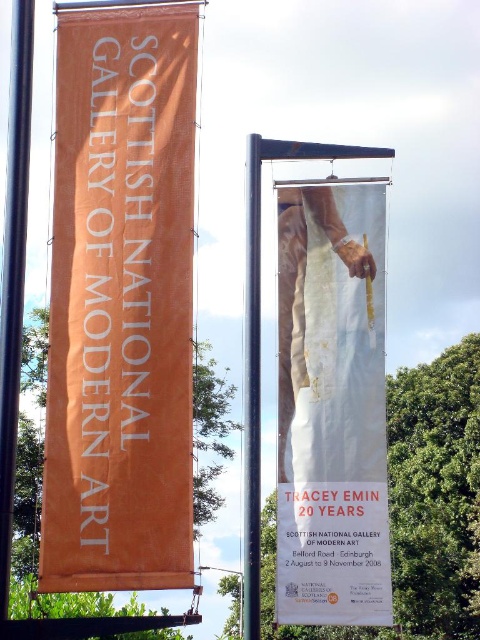
Question: Which point appears closest to the camera in this image?

Choices:
 (A) (139, 490)
 (B) (348, 220)

Answer: (A)

Question: Is orange fabric banner at left to the left of white paper at center from the viewer's perspective?

Choices:
 (A) yes
 (B) no

Answer: (A)

Question: Can you confirm if orange fabric banner at left is positioned to the right of white paper at center?

Choices:
 (A) no
 (B) yes

Answer: (A)

Question: Observing the image, what is the correct spatial positioning of orange fabric banner at left in reference to white paper at center?

Choices:
 (A) left
 (B) right

Answer: (A)